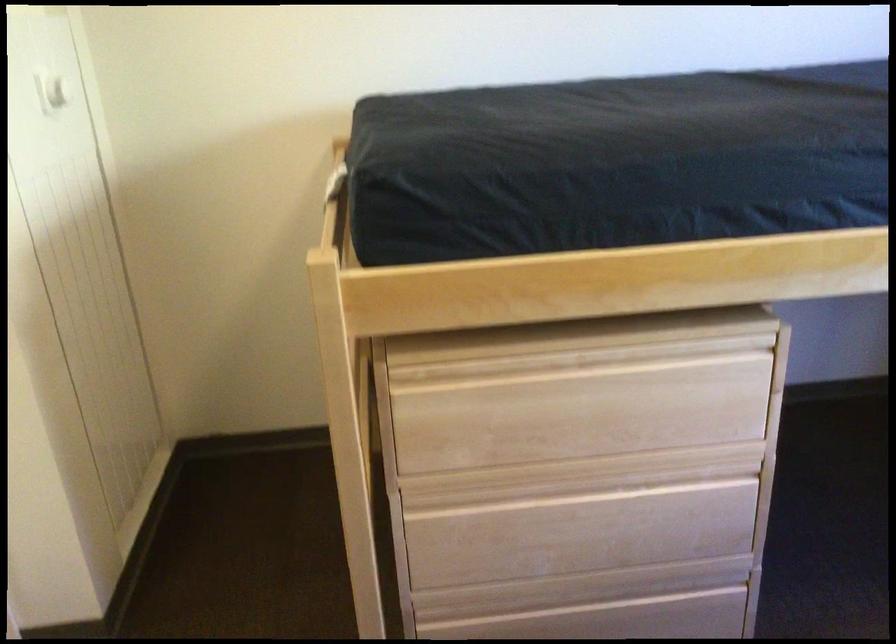
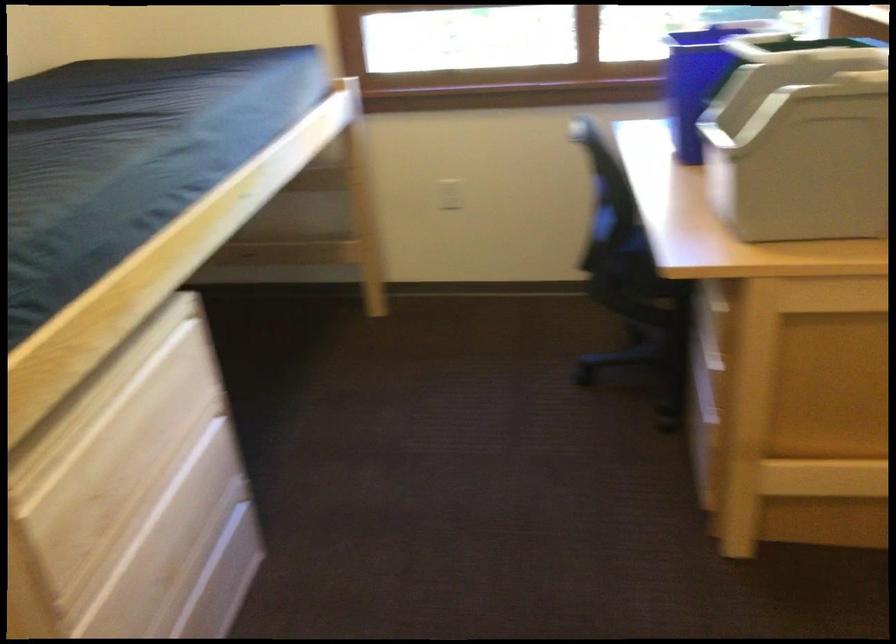
Consider the image. How did the camera likely rotate?

The camera's rotation is toward right-down.